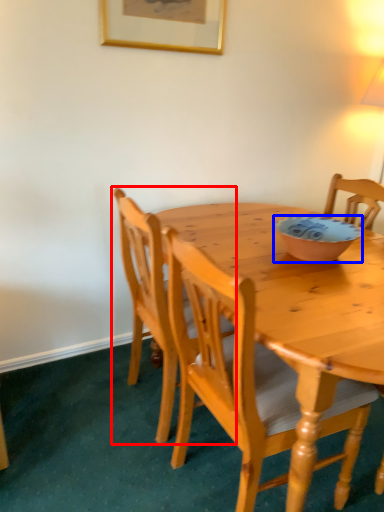
Question: Which object appears farthest to the camera in this image, chair (highlighted by a red box) or bowl (highlighted by a blue box)?

Choices:
 (A) chair
 (B) bowl

Answer: (B)